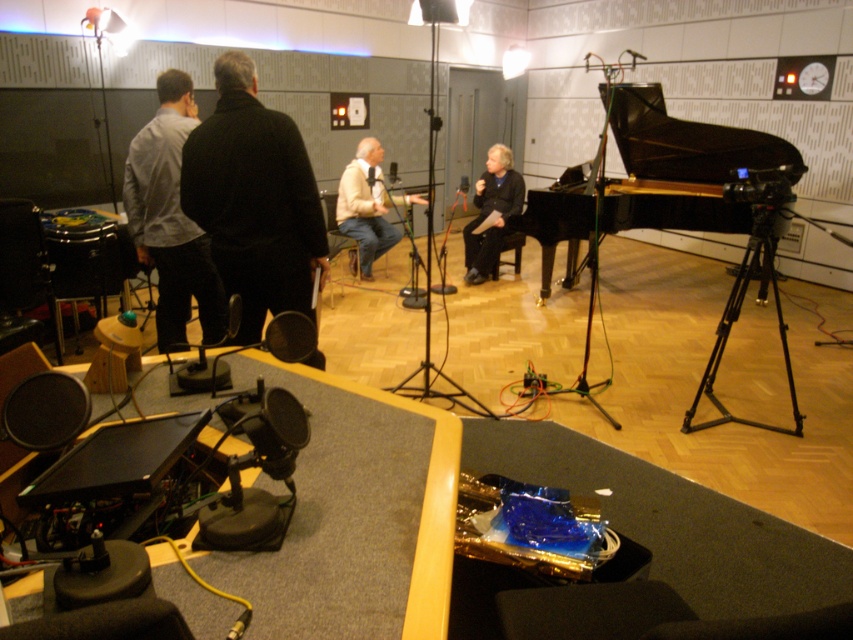
Question: Where is black polished piano at center located in relation to black matte tripod at center in the image?

Choices:
 (A) below
 (B) above

Answer: (B)

Question: Which point appears closest to the camera in this image?

Choices:
 (A) (376, 189)
 (B) (231, 65)
 (C) (463, 230)

Answer: (B)

Question: Estimate the real-world distances between objects in this image. Which object is closer to the black metal tripod at right?

Choices:
 (A) black matte jacket at center
 (B) black polished piano at center
 (C) black matte tripod at center

Answer: (B)

Question: Estimate the real-world distances between objects in this image. Which object is farther from the black matte tripod at center?

Choices:
 (A) black matte jacket at center
 (B) light gray fabric shirt at left
 (C) light beige sweater at center
 (D) black polished piano at center

Answer: (C)

Question: Does black matte jacket at center have a larger size compared to black metal tripod at right?

Choices:
 (A) no
 (B) yes

Answer: (A)

Question: Is light gray fabric shirt at left positioned before black metal tripod at right?

Choices:
 (A) no
 (B) yes

Answer: (B)